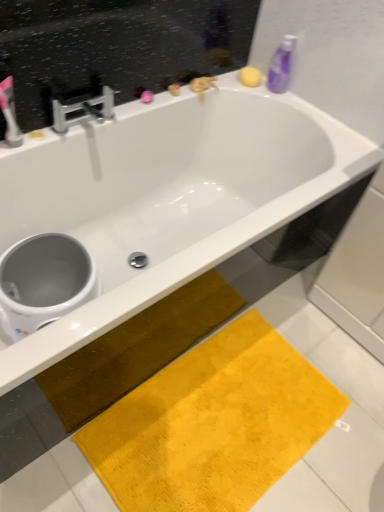
Question: From the image's perspective, would you say white glossy toilet bowl at lower left is positioned over purple plastic bottle at upper right?

Choices:
 (A) yes
 (B) no

Answer: (B)

Question: From a real-world perspective, is white glossy toilet bowl at lower left on top of purple plastic bottle at upper right?

Choices:
 (A) no
 (B) yes

Answer: (A)

Question: Does white glossy toilet bowl at lower left have a greater width compared to purple plastic bottle at upper right?

Choices:
 (A) yes
 (B) no

Answer: (A)

Question: Is white glossy toilet bowl at lower left closer to camera compared to purple plastic bottle at upper right?

Choices:
 (A) no
 (B) yes

Answer: (B)

Question: From a real-world perspective, does white glossy toilet bowl at lower left sit lower than purple plastic bottle at upper right?

Choices:
 (A) yes
 (B) no

Answer: (A)

Question: From a real-world perspective, relative to white glossy toilet bowl at lower left, is yellow plush bath mat at lower center vertically above or below?

Choices:
 (A) above
 (B) below

Answer: (B)

Question: Is point (140, 392) closer or farther from the camera than point (18, 300)?

Choices:
 (A) closer
 (B) farther

Answer: (B)

Question: From the image's perspective, is yellow plush bath mat at lower center located above or below white glossy toilet bowl at lower left?

Choices:
 (A) above
 (B) below

Answer: (B)

Question: Which is correct: yellow plush bath mat at lower center is inside white glossy toilet bowl at lower left, or outside of it?

Choices:
 (A) inside
 (B) outside

Answer: (B)

Question: Is matte white toothbrush at upper left taller or shorter than yellow plush bath mat at lower center?

Choices:
 (A) short
 (B) tall

Answer: (B)

Question: Choose the correct answer: Is matte white toothbrush at upper left inside yellow plush bath mat at lower center or outside it?

Choices:
 (A) inside
 (B) outside

Answer: (B)

Question: From a real-world perspective, is matte white toothbrush at upper left above or below yellow plush bath mat at lower center?

Choices:
 (A) below
 (B) above

Answer: (B)

Question: From the image's perspective, is matte white toothbrush at upper left located above or below yellow plush bath mat at lower center?

Choices:
 (A) below
 (B) above

Answer: (B)

Question: Would you say yellow plush bath mat at lower center is to the left or to the right of matte white toothbrush at upper left in the picture?

Choices:
 (A) right
 (B) left

Answer: (A)

Question: Does point (x=148, y=479) appear closer or farther from the camera than point (x=0, y=97)?

Choices:
 (A) farther
 (B) closer

Answer: (A)